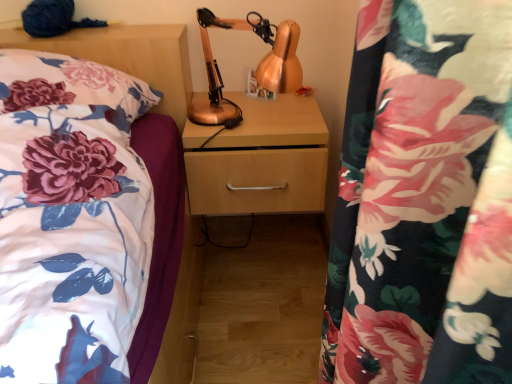
The height and width of the screenshot is (384, 512). In order to click on wooden drawer at center in this screenshot , I will do `click(260, 159)`.

Measure the distance between point [280,138] and camera.

They are 3.80 feet apart.

What do you see at coordinates (256, 69) in the screenshot?
I see `copper metallic table lamp at center` at bounding box center [256, 69].

What is the approximate height of floral fabric pillow at left?

It is 8.92 inches.

You are a GUI agent. You are given a task and a screenshot of the screen. Output one action in this format:
    pyautogui.click(x=<x>, y=<y>)
    Task: Click on the wooden drawer at center
    The width and height of the screenshot is (512, 384).
    Given the screenshot: What is the action you would take?
    pyautogui.click(x=260, y=159)

From the image's perspective, is copper metallic table lamp at center positioned above or below wooden drawer at center?

copper metallic table lamp at center is situated higher than wooden drawer at center in the image.

Is point (218, 99) closer or farther from the camera than point (192, 126)?

Point (218, 99).

Between copper metallic table lamp at center and wooden drawer at center, which one has smaller width?

copper metallic table lamp at center.

Is wooden drawer at center looking in the opposite direction of copper metallic table lamp at center?

No, wooden drawer at center is not facing the opposite direction of copper metallic table lamp at center.

Can copper metallic table lamp at center be found inside wooden drawer at center?

Definitely not — copper metallic table lamp at center is not inside wooden drawer at center.

Can you confirm if wooden drawer at center is positioned to the left of copper metallic table lamp at center?

In fact, wooden drawer at center is to the right of copper metallic table lamp at center.

How different are the orientations of copper metallic table lamp at center and floral fabric pillow at left in degrees?

The angle between the facing direction of copper metallic table lamp at center and the facing direction of floral fabric pillow at left is 0.649 degrees.

From the image's perspective, which object appears higher, copper metallic table lamp at center or floral fabric pillow at left?

copper metallic table lamp at center.

Is copper metallic table lamp at center taller than floral fabric pillow at left?

Yes, copper metallic table lamp at center is taller than floral fabric pillow at left.

Which of these two, copper metallic table lamp at center or floral fabric pillow at left, is bigger?

floral fabric pillow at left is bigger.

Does floral fabric pillow at left turn towards copper metallic table lamp at center?

No, floral fabric pillow at left does not turn towards copper metallic table lamp at center.

Does floral fabric pillow at left contain copper metallic table lamp at center?

No, floral fabric pillow at left does not contain copper metallic table lamp at center.

Does point (76, 96) come farther from viewer compared to point (202, 105)?

No, (76, 96) is in front of (202, 105).

From the picture: Which object is further away from the camera, floral fabric pillow at left or copper metallic table lamp at center?

copper metallic table lamp at center.

Who is smaller, floral fabric pillow at left or wooden drawer at center?

With smaller size is wooden drawer at center.

From a real-world perspective, is floral fabric pillow at left positioned over wooden drawer at center based on gravity?

Indeed, from a real-world perspective, floral fabric pillow at left stands above wooden drawer at center.

Does floral fabric pillow at left have a lesser width compared to wooden drawer at center?

In fact, floral fabric pillow at left might be wider than wooden drawer at center.

Considering the relative positions of wooden drawer at center and floral fabric pillow at left in the image provided, is wooden drawer at center to the left of floral fabric pillow at left from the viewer's perspective?

Incorrect, wooden drawer at center is not on the left side of floral fabric pillow at left.

In terms of width, does wooden drawer at center look wider or thinner when compared to floral fabric pillow at left?

In the image, wooden drawer at center appears to be more narrow than floral fabric pillow at left.

In the scene shown: Is wooden drawer at center surrounding floral fabric pillow at left?

No, floral fabric pillow at left is not a part of wooden drawer at center.

From the image's perspective, is wooden drawer at center beneath floral fabric pillow at left?

Yes, from the image's perspective, wooden drawer at center is beneath floral fabric pillow at left.

This screenshot has width=512, height=384. Find the location of `dresser that appears behind the copper metallic table lamp at center`. dresser that appears behind the copper metallic table lamp at center is located at coordinates [x=260, y=159].

This screenshot has height=384, width=512. In order to click on table lamp in front of the wooden drawer at center in this screenshot , I will do `click(256, 69)`.

Based on their spatial positions, is copper metallic table lamp at center or floral fabric pillow at left closer to wooden drawer at center?

The object closer to wooden drawer at center is copper metallic table lamp at center.

From the picture: Based on their spatial positions, is wooden drawer at center or floral fabric pillow at left closer to copper metallic table lamp at center?

Among the two, wooden drawer at center is located nearer to copper metallic table lamp at center.

Looking at the image, which one is located further to floral fabric pillow at left, wooden drawer at center or copper metallic table lamp at center?

wooden drawer at center.

When comparing their distances from wooden drawer at center, does floral fabric pillow at left or copper metallic table lamp at center seem closer?

copper metallic table lamp at center lies closer to wooden drawer at center than the other object.

When comparing their distances from copper metallic table lamp at center, does floral fabric pillow at left or wooden drawer at center seem closer?

Among the two, wooden drawer at center is located nearer to copper metallic table lamp at center.

When comparing their distances from floral fabric pillow at left, does copper metallic table lamp at center or wooden drawer at center seem further?

wooden drawer at center.

This screenshot has width=512, height=384. I want to click on table lamp between floral fabric pillow at left and wooden drawer at center from left to right, so click(x=256, y=69).